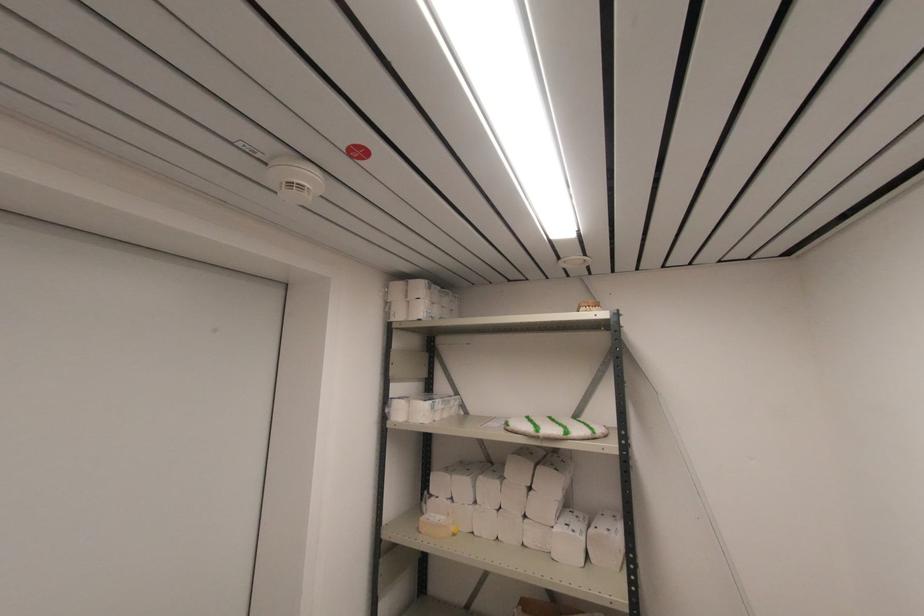
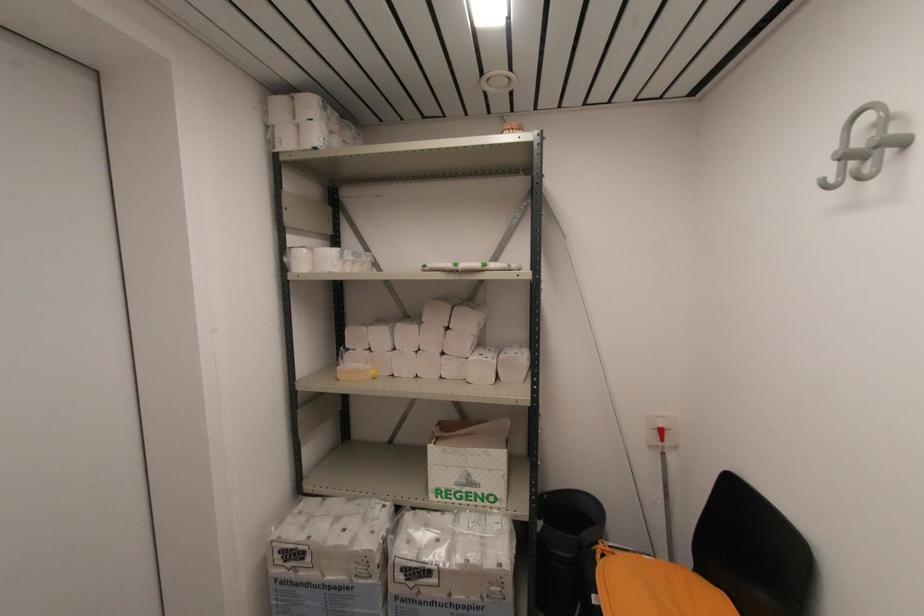
Where in the second image is the point corresponding to (417,320) from the first image?

(310, 148)